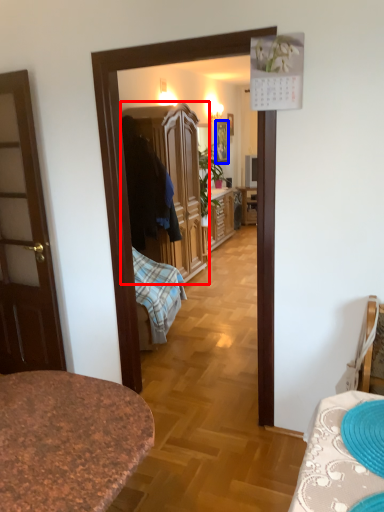
Question: Among these objects, which one is farthest to the camera, cabinetry (highlighted by a red box) or picture frame (highlighted by a blue box)?

Choices:
 (A) cabinetry
 (B) picture frame

Answer: (B)